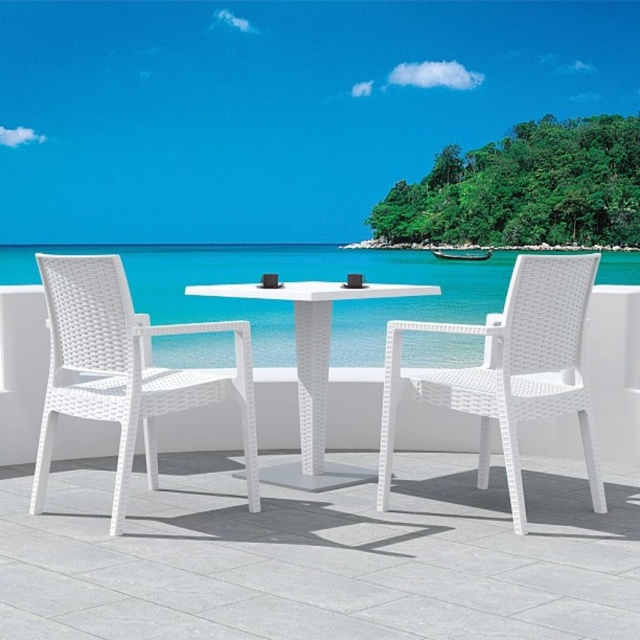
Is white wicker chair at center below white woven table at center?

No.

Does point (392, 340) come behind point (323, 385)?

No, it is in front of (323, 385).

Measure the distance between white wicker chair at center and camera.

The distance of white wicker chair at center from camera is 2.42 meters.

Locate an element on the screen. white wicker chair at center is located at coordinates (508, 371).

Is point (90, 324) closer to camera compared to point (520, 374)?

Yes.

Between white wicker chair at left and white wicker chair at center, which one has more height?

white wicker chair at center is taller.

Between point (88, 380) and point (540, 385), which one is positioned in front?

Point (540, 385) is in front.

At what (x,y) coordinates should I click in order to perform the action: click on white wicker chair at left. Please return your answer as a coordinate pair (x, y). This screenshot has height=640, width=640. Looking at the image, I should click on (125, 371).

Which of these two, white wicker chair at left or white woven table at center, stands shorter?

white woven table at center is shorter.

Is white wicker chair at left to the left of white woven table at center from the viewer's perspective?

Correct, you'll find white wicker chair at left to the left of white woven table at center.

Is point (72, 294) farther from camera compared to point (378, 291)?

That is False.

The image size is (640, 640). I want to click on white wicker chair at left, so click(x=125, y=371).